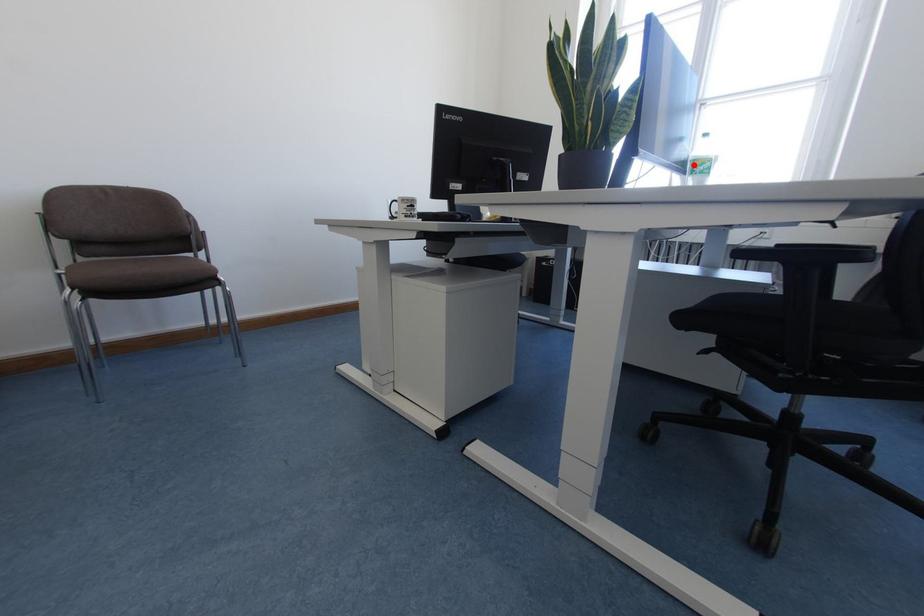
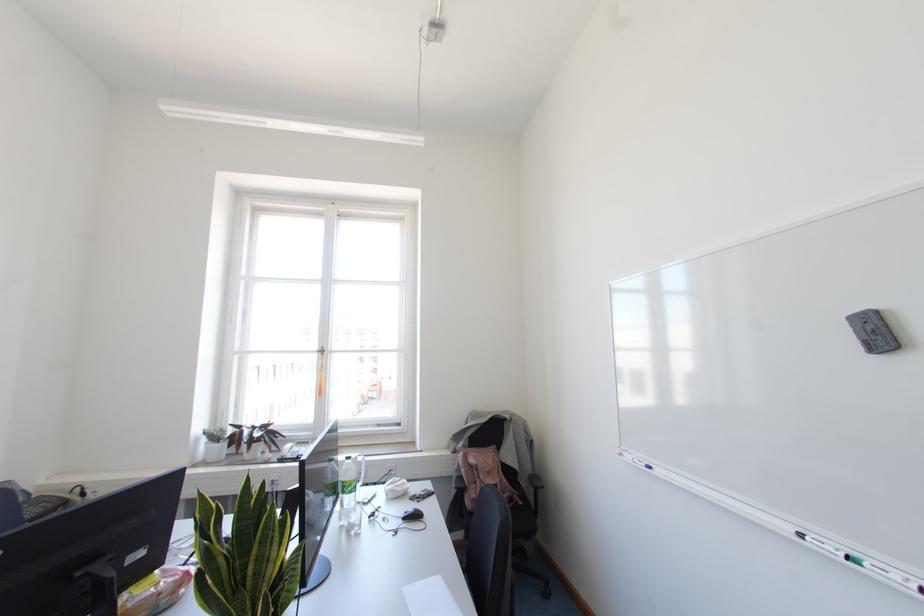
Question: I am providing you with two images of the same scene from different viewpoints. Given a red point in image1, look at the same physical point in image2. Is it:

Choices:
 (A) Closer to the viewpoint
 (B) Farther from the viewpoint

Answer: (A)